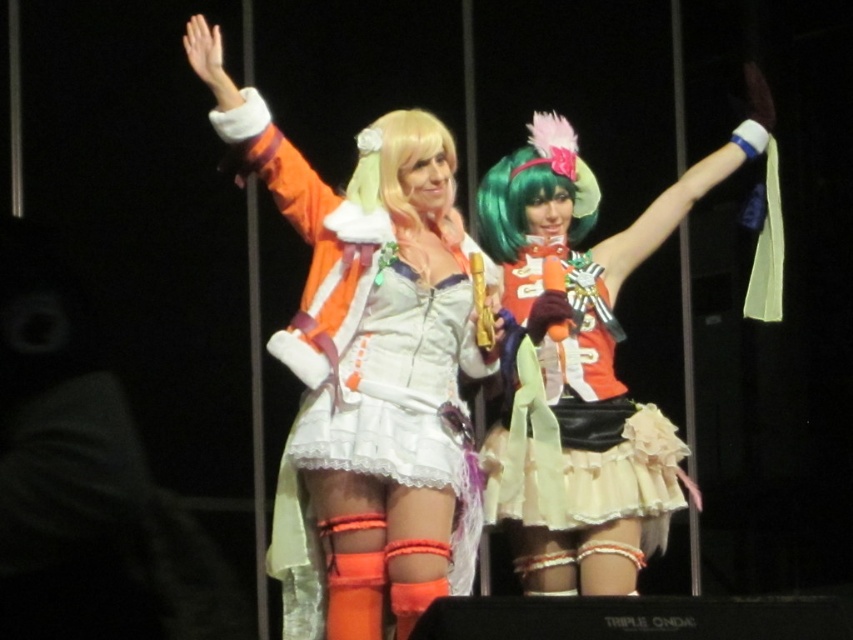
Question: Is shiny green wig at center smaller than blonde wig at center?

Choices:
 (A) yes
 (B) no

Answer: (B)

Question: Can you confirm if shiny green wig at center is smaller than blonde wig at center?

Choices:
 (A) yes
 (B) no

Answer: (B)

Question: Is shiny green wig at center wider than orange satin skirt at center?

Choices:
 (A) no
 (B) yes

Answer: (B)

Question: Among these objects, which one is farthest from the camera?

Choices:
 (A) shiny green wig at center
 (B) matte orange jacket at center
 (C) green matte wig at center

Answer: (C)

Question: Which point is farther from the camera taking this photo?

Choices:
 (A) (386, 144)
 (B) (564, 509)

Answer: (B)

Question: Which object is closer to the camera taking this photo?

Choices:
 (A) green matte wig at center
 (B) orange satin skirt at center

Answer: (B)